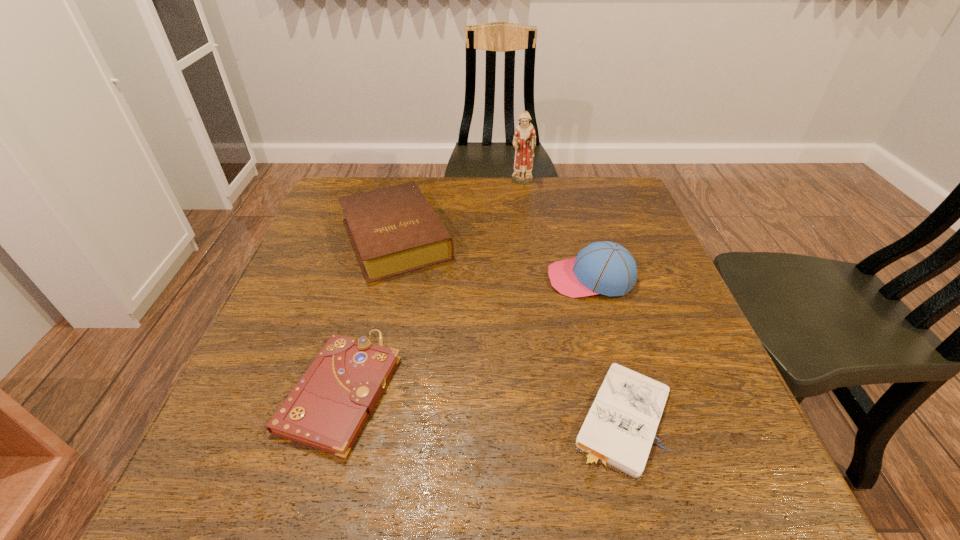
The width and height of the screenshot is (960, 540). In the image, there is a desktop. What are the coordinates of `free space at the near right corner` in the screenshot? It's located at pos(732,491).

Where is `blank region between the baseball cap and the tallest object`? The height and width of the screenshot is (540, 960). blank region between the baseball cap and the tallest object is located at coordinates (557, 231).

The image size is (960, 540). I want to click on empty location between the shortest object and the baseball cap, so click(606, 348).

The height and width of the screenshot is (540, 960). I want to click on unoccupied area between the third shortest object and the farthest object, so click(459, 210).

You are a GUI agent. You are given a task and a screenshot of the screen. Output one action in this format:
    pyautogui.click(x=<x>, y=<y>)
    Task: Click on the free space between the third shortest object and the figurine
    This screenshot has width=960, height=540.
    Given the screenshot: What is the action you would take?
    pyautogui.click(x=459, y=210)

In order to click on free space between the figurine and the left notebook in this screenshot , I will do `click(432, 286)`.

This screenshot has width=960, height=540. Find the location of `free point between the farthest object and the right notebook`. free point between the farthest object and the right notebook is located at coordinates (572, 300).

You are a GUI agent. You are given a task and a screenshot of the screen. Output one action in this format:
    pyautogui.click(x=<x>, y=<y>)
    Task: Click on the vacant region between the farthest object and the fourth tallest object
    
    Given the screenshot: What is the action you would take?
    pyautogui.click(x=432, y=286)

This screenshot has height=540, width=960. In order to click on free space between the shortest object and the figurine in this screenshot , I will do `click(572, 300)`.

The image size is (960, 540). I want to click on free space that is in between the shorter notebook and the farthest object, so click(x=572, y=300).